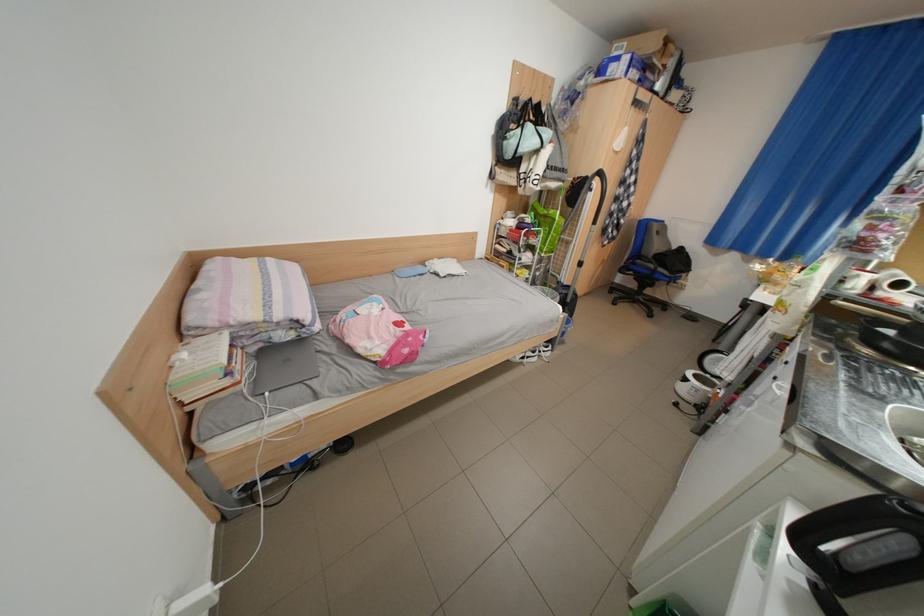
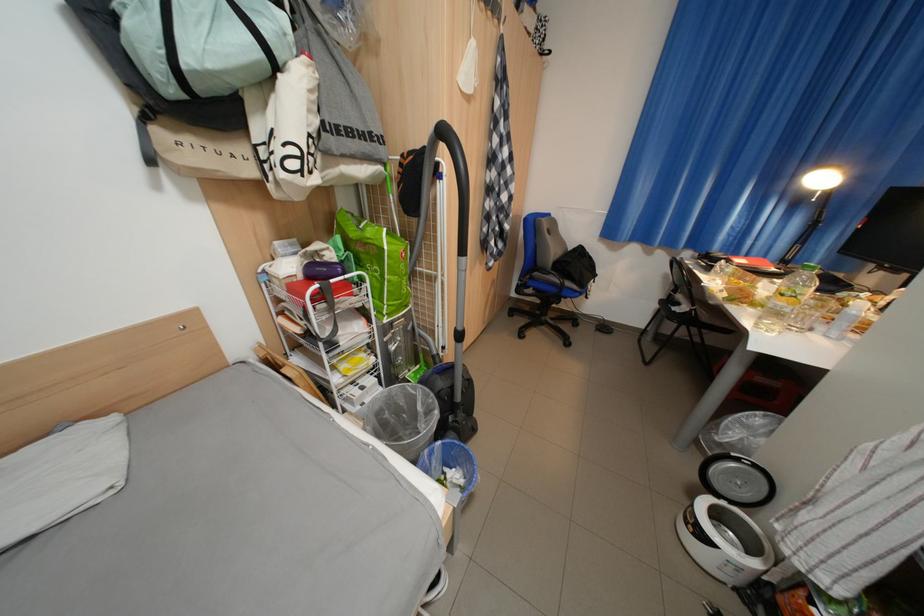
What movement of the cameraman would produce the second image?

The cameraman walked toward right, forward.